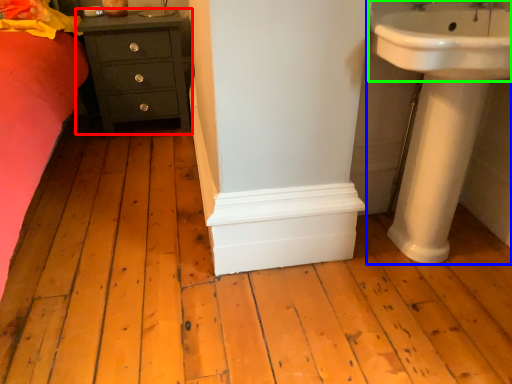
Question: Considering the real-world distances, which object is closest to chest of drawers (highlighted by a red box)? sink (highlighted by a blue box) or sink (highlighted by a green box).

Choices:
 (A) sink
 (B) sink

Answer: (A)